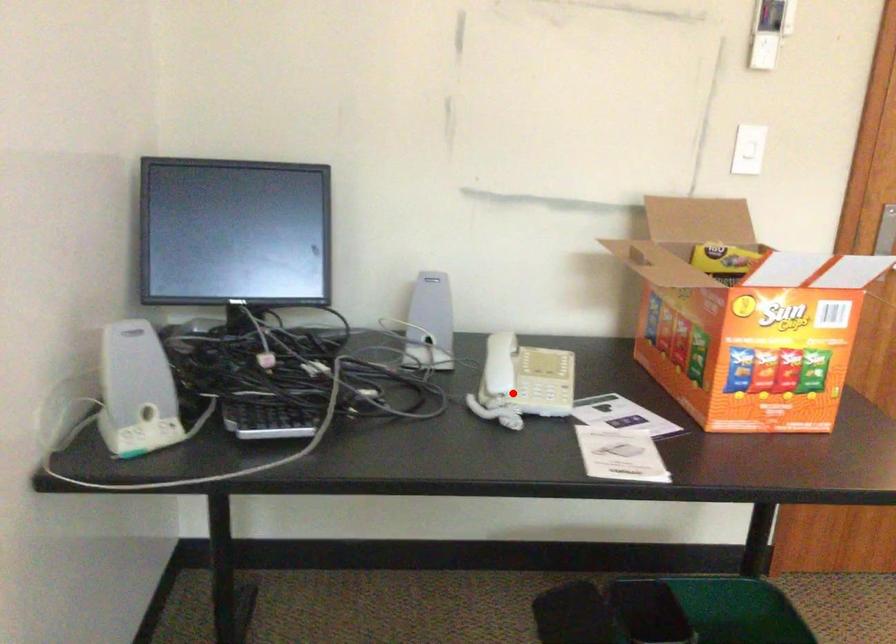
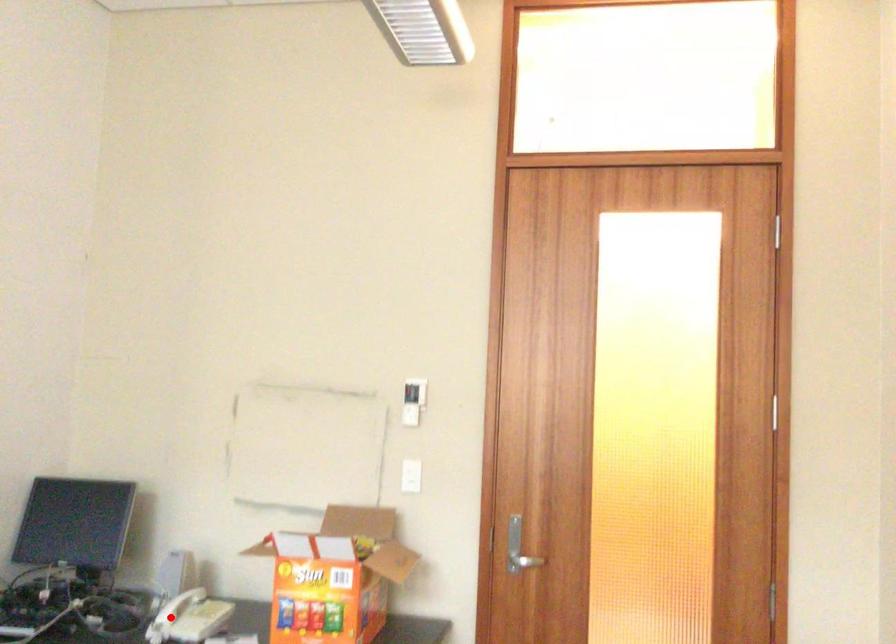
I am providing you with two images of the same scene from different viewpoints. A red point is marked on the first image and another point is marked on the second image. Do the highlighted points in image1 and image2 indicate the same real-world spot?

Yes